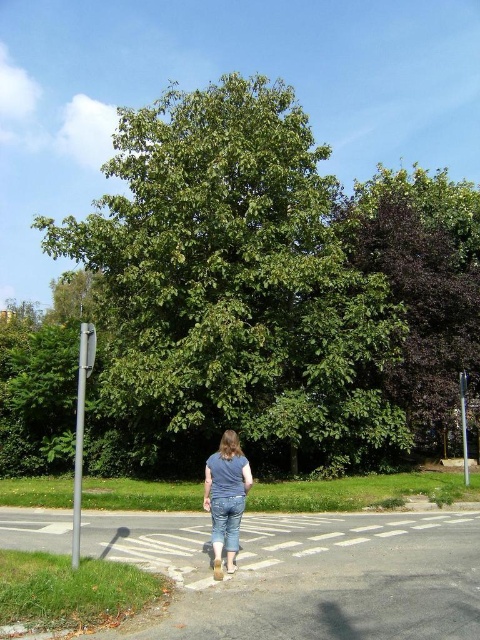
You are a pedestrian standing on the white asphalt at center. You want to walk to the dark purple leafy tree at upper right. Which direction should you head?

You should head to the right since the dark purple leafy tree at upper right is to the right of white asphalt at center.

You are a photographer trying to capture a photo of the dark purple leafy tree at upper right and the white asphalt at center. Which object should you focus on first if you want to ensure both are in sharp focus, considering their sizes and positions?

The dark purple leafy tree at upper right is much taller than the white asphalt at center, so focusing on the tree first would help ensure both are in sharp focus due to its larger size and distance from the camera.

You are a pedestrian standing on the white asphalt at center. You want to walk to the green leafy tree at center. Is the path clear between you and the tree?

The green leafy tree at center is bigger than white asphalt at center, so the path between you and the tree is clear since the tree is larger and does not block the way.